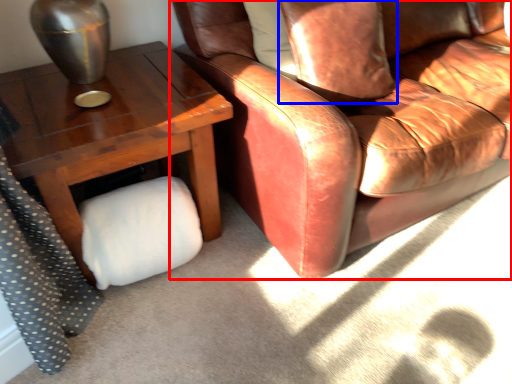
Question: Which object appears closest to the camera in this image, chair (highlighted by a red box) or pillow (highlighted by a blue box)?

Choices:
 (A) chair
 (B) pillow

Answer: (A)